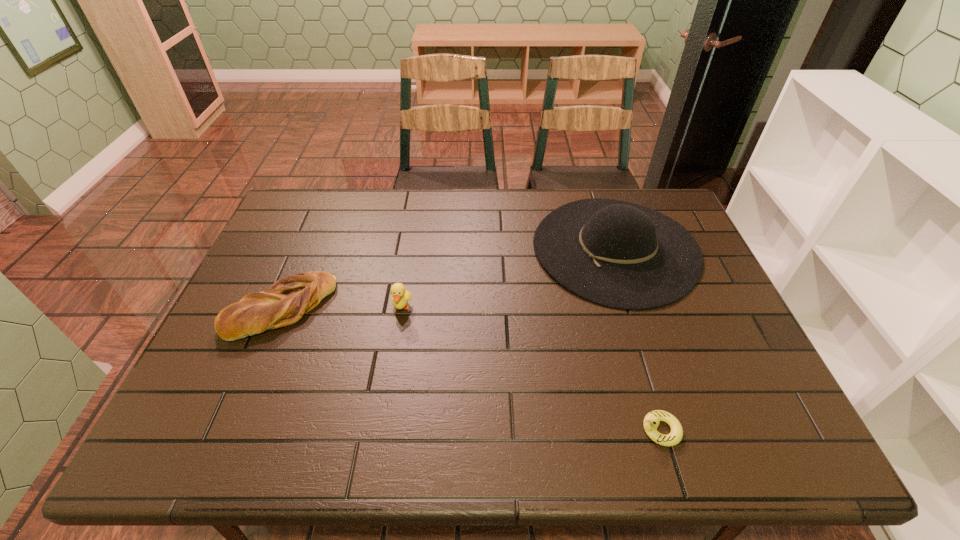
Identify the location of vacant space at the far edge. This screenshot has width=960, height=540. (461, 225).

Find the location of `free space at the near edge of the desktop`. free space at the near edge of the desktop is located at coordinates (436, 452).

I want to click on vacant space at the left edge of the desktop, so click(x=281, y=264).

Locate an element on the screen. The height and width of the screenshot is (540, 960). free space at the right edge is located at coordinates (708, 369).

Identify the location of vacant space at the far right corner of the desktop. (678, 215).

In the image, there is a desktop. At what (x,y) coordinates should I click in order to perform the action: click on vacant space at the near right corner. Please return your answer as a coordinate pair (x, y). Looking at the image, I should click on (721, 435).

Identify the location of free point between the farther duckling and the nearer duckling. (531, 368).

Find the location of a particular element. empty space that is in between the taller duckling and the leftmost object is located at coordinates (342, 307).

Find the location of a particular element. The image size is (960, 540). unoccupied position between the shortest object and the tallest object is located at coordinates (637, 339).

Locate an element on the screen. Image resolution: width=960 pixels, height=540 pixels. free point between the second shortest object and the sombrero is located at coordinates (448, 278).